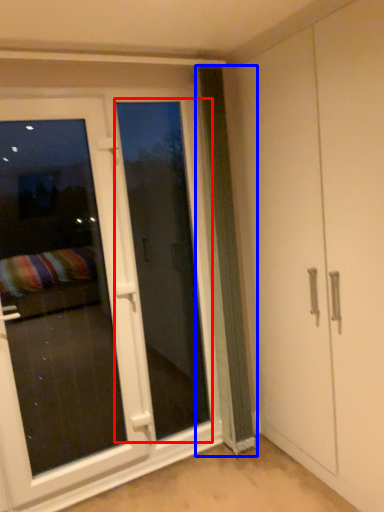
Question: Which point is further to the camera, screen door (highlighted by a red box) or curtain (highlighted by a blue box)?

Choices:
 (A) screen door
 (B) curtain

Answer: (A)